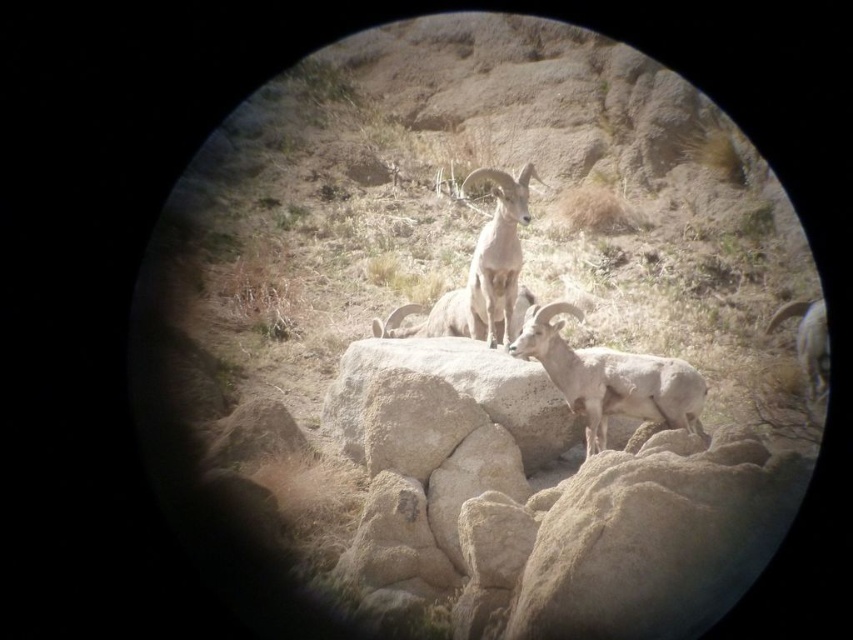
You are a wildlife photographer trying to capture a photo of the white woolly sheep at center and brown woolen goat at center. Since the camera can only focus on one animal at a time, which animal should you focus on first if you want to ensure the one closer to the camera is sharp?

The white woolly sheep at center is to the right of the brown woolen goat at center, so it is closer to the camera. Therefore, you should focus on the white woolly sheep at center first to ensure it is sharp.

You are standing at the center of the image and want to locate the point at coordinates (497, 253). According to the scene description, which object is this point located on?

The point at coordinates (497, 253) is located on the brown woolen goat at center.

You are a wildlife photographer trying to capture a photo of the white woolly sheep at center and the white woolen goat at right. Since the camera can only focus on one animal at a time, which animal should you focus on to ensure it appears larger in the final image?

The white woolly sheep at center is bigger than the white woolen goat at right, so focusing on the white woolly sheep at center will ensure it appears larger in the final image.